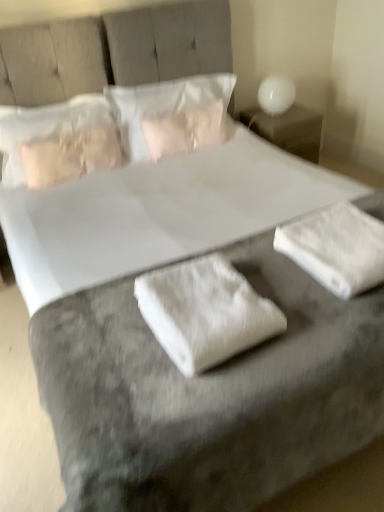
The image size is (384, 512). Identify the location of vacant region below white glossy table lamp at upper right (from a real-world perspective). pos(281,113).